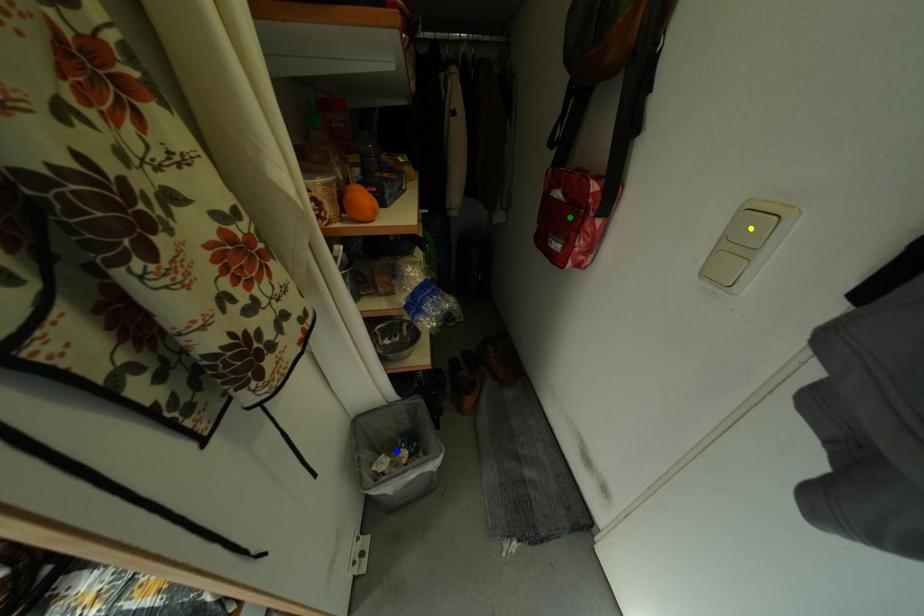
Order these from nearest to farthest:
green point
yellow point
blue point

blue point < green point < yellow point